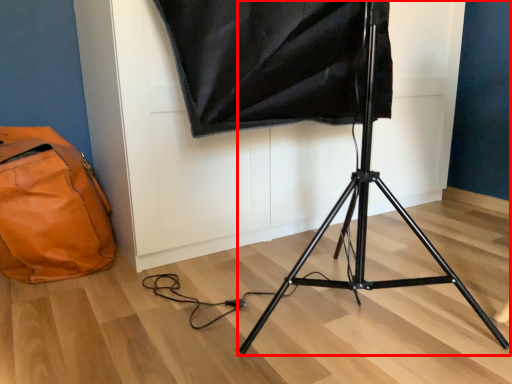
Question: From the image's perspective, considering the relative positions of tripod (annotated by the red box) and bag in the image provided, where is tripod (annotated by the red box) located with respect to the staircase?

Choices:
 (A) above
 (B) below

Answer: (A)